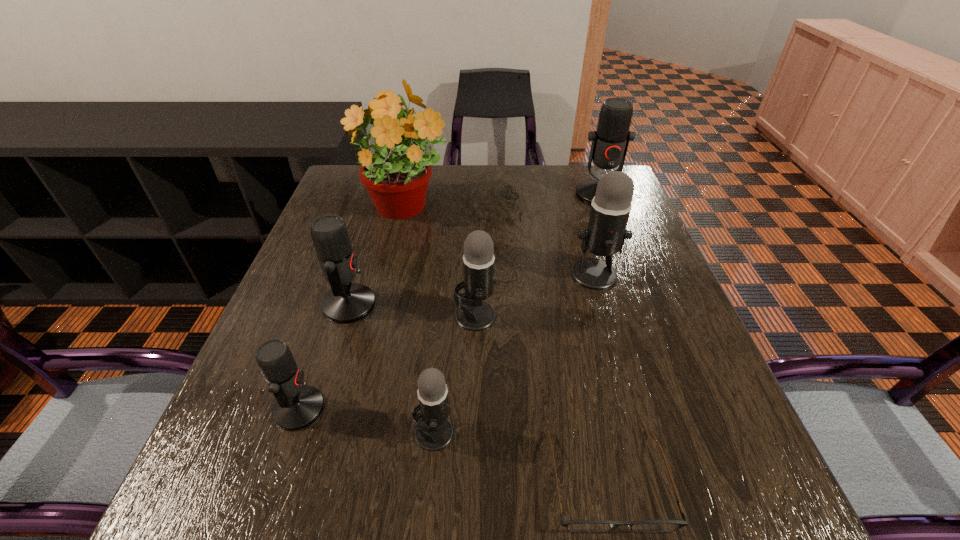
Find the location of `empty location between the flowerpot and the biggest red microphone`. empty location between the flowerpot and the biggest red microphone is located at coordinates (502, 202).

You are a GUI agent. You are given a task and a screenshot of the screen. Output one action in this format:
    pyautogui.click(x=<x>, y=<y>)
    Task: Click on the unoccupied position between the shortest object and the smallest red microphone
    The height and width of the screenshot is (540, 960).
    Given the screenshot: What is the action you would take?
    pyautogui.click(x=453, y=444)

The width and height of the screenshot is (960, 540). I want to click on object that is the third nearest to the spectacles, so pos(606,233).

Identify which object is the third closest to the rightmost gray microphone. Please provide its 2D coordinates. Your answer should be formatted as a tuple, i.e. [(x, y)], where the tuple contains the x and y coordinates of a point satisfying the conditions above.

[(397, 182)]

Identify which microphone is the second closest to the farthest red microphone. Please provide its 2D coordinates. Your answer should be formatted as a tuple, i.e. [(x, y)], where the tuple contains the x and y coordinates of a point satisfying the conditions above.

[(473, 314)]

The height and width of the screenshot is (540, 960). I want to click on microphone that stands as the fifth closest to the smallest red microphone, so click(x=610, y=141).

Locate an element on the screen. The height and width of the screenshot is (540, 960). red microphone that is the third closest to the shortest object is located at coordinates (610, 141).

Select which red microphone appears as the closest to the biggest gray microphone. Please provide its 2D coordinates. Your answer should be formatted as a tuple, i.e. [(x, y)], where the tuple contains the x and y coordinates of a point satisfying the conditions above.

[(610, 141)]

Locate an element on the screen. This screenshot has height=540, width=960. gray microphone that stands as the third closest to the farthest red microphone is located at coordinates (434, 432).

Identify which gray microphone is the nearest to the rightmost red microphone. Please provide its 2D coordinates. Your answer should be formatted as a tuple, i.e. [(x, y)], where the tuple contains the x and y coordinates of a point satisfying the conditions above.

[(606, 233)]